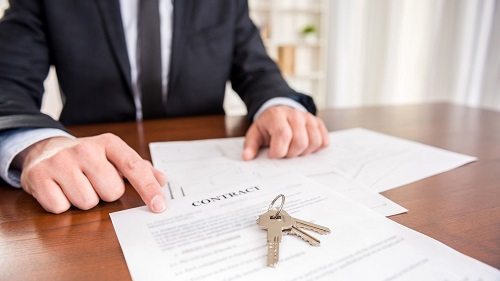
I want to click on keys, so click(x=273, y=220).